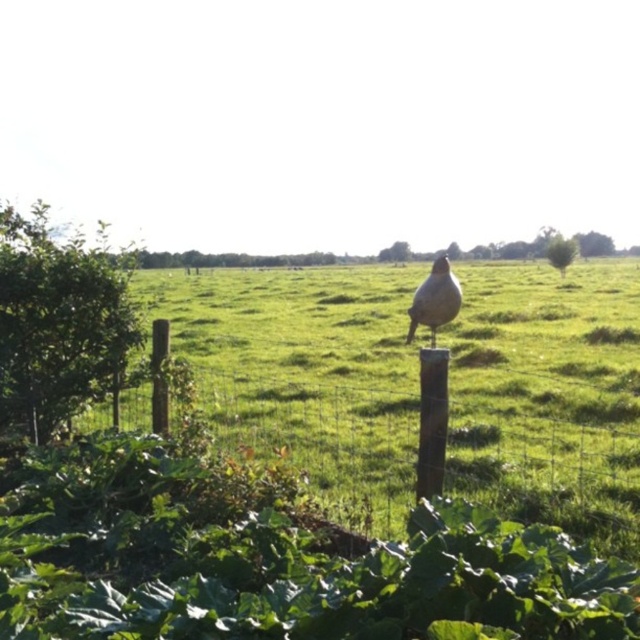
Who is more distant from viewer, (362, 454) or (454, 284)?

The point (454, 284) is more distant.

Does brown wooden post at center appear on the right side of brown speckled bird at center?

No, brown wooden post at center is not to the right of brown speckled bird at center.

Locate an element on the screen. Image resolution: width=640 pixels, height=640 pixels. brown wooden post at center is located at coordinates (323, 436).